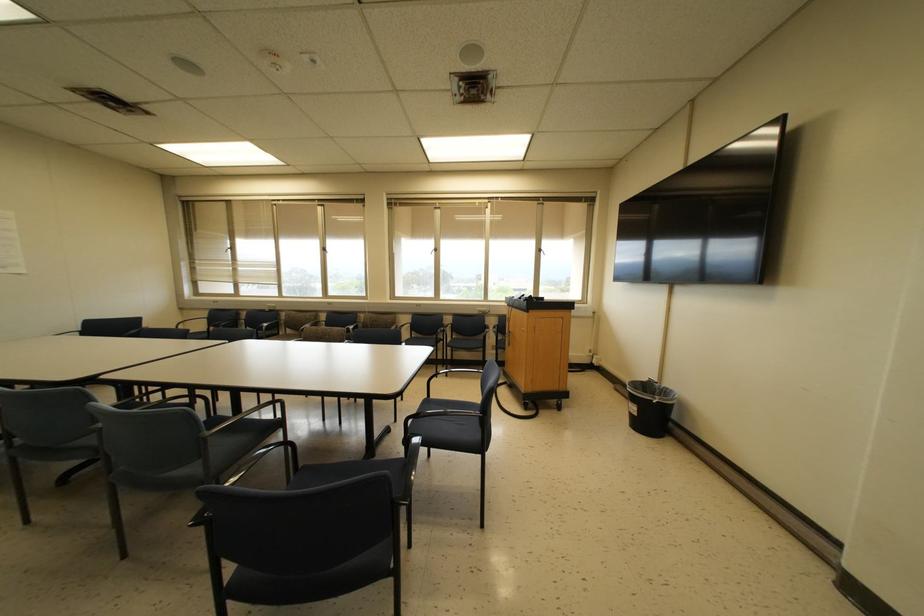
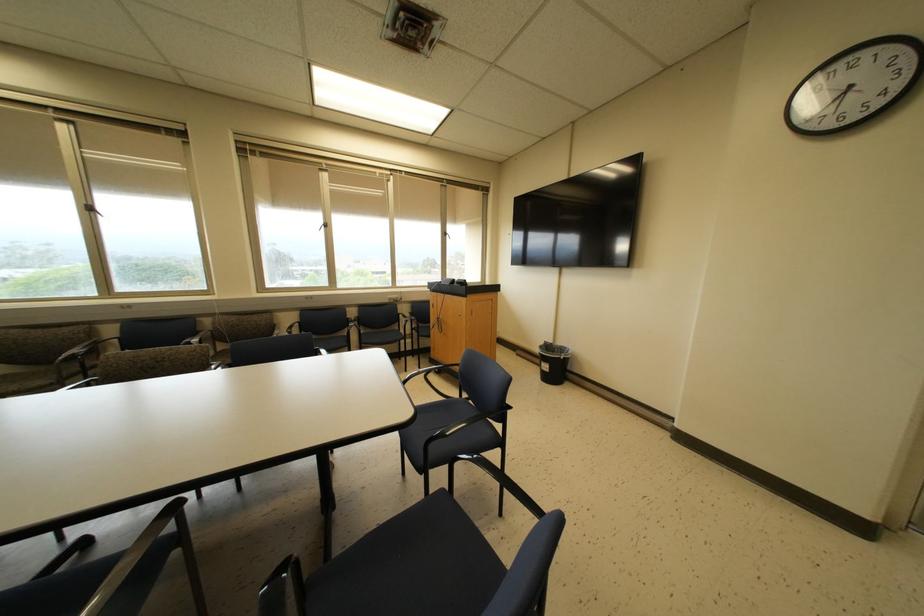
Locate, in the second image, the point that corresponds to point 538,249 in the first image.

(444, 233)